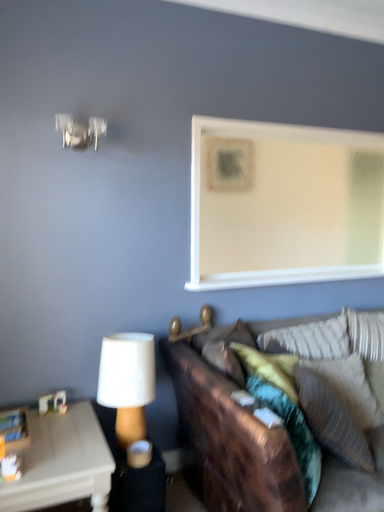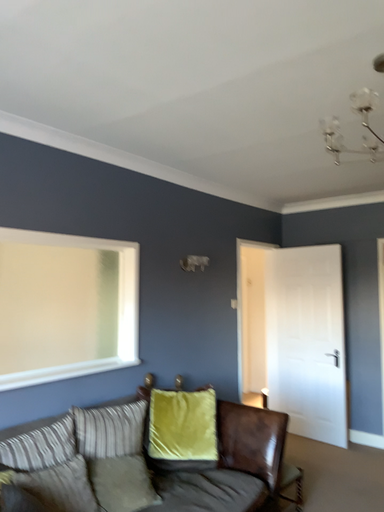
Question: How did the camera likely rotate when shooting the video?

Choices:
 (A) rotated right
 (B) rotated left

Answer: (A)